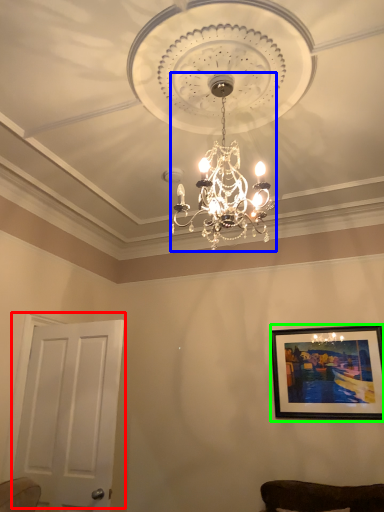
Question: Which is farther away from door (highlighted by a red box)? lamp (highlighted by a blue box) or picture frame (highlighted by a green box)?

Choices:
 (A) lamp
 (B) picture frame

Answer: (B)